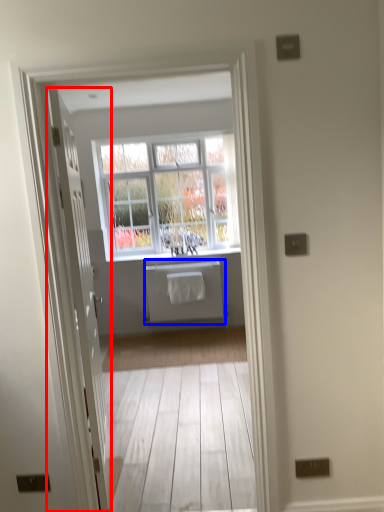
Question: Among these objects, which one is nearest to the camera, door (highlighted by a red box) or appliance (highlighted by a blue box)?

Choices:
 (A) door
 (B) appliance

Answer: (A)